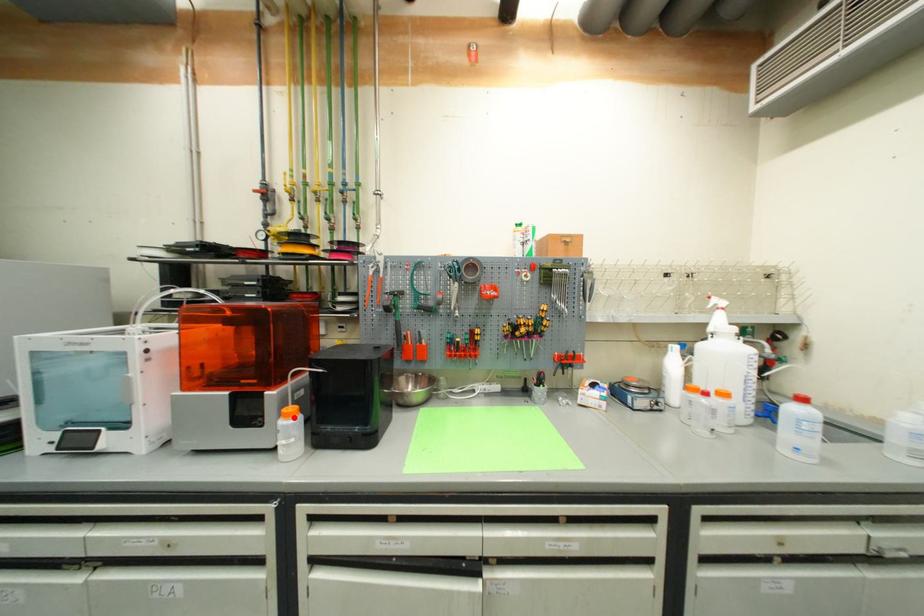
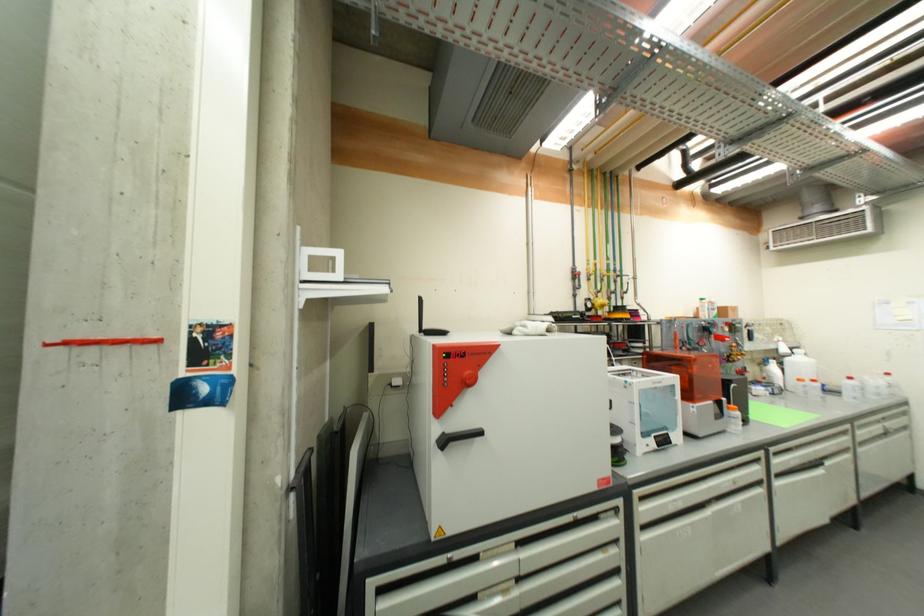
Find the pixel in the second image that matches the highlighted location in the first image.

(739, 411)